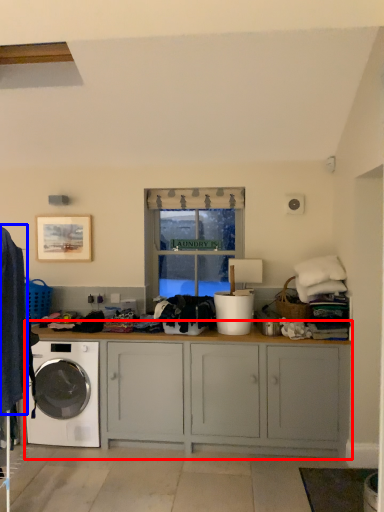
Question: Among these objects, which one is farthest to the camera, cabinetry (highlighted by a red box) or clothing (highlighted by a blue box)?

Choices:
 (A) cabinetry
 (B) clothing

Answer: (A)